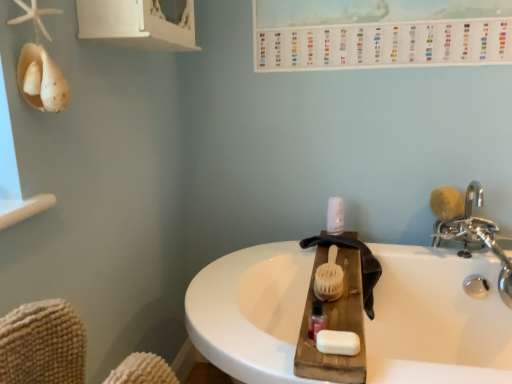
Question: From a real-world perspective, does silver metallic faucet at upper right stand above white plastic pump at center?

Choices:
 (A) yes
 (B) no

Answer: (B)

Question: Considering the relative positions of silver metallic faucet at upper right and white plastic pump at center in the image provided, is silver metallic faucet at upper right to the right of white plastic pump at center from the viewer's perspective?

Choices:
 (A) yes
 (B) no

Answer: (A)

Question: Considering the relative sizes of silver metallic faucet at upper right and white plastic pump at center in the image provided, is silver metallic faucet at upper right smaller than white plastic pump at center?

Choices:
 (A) yes
 (B) no

Answer: (B)

Question: From the image's perspective, would you say silver metallic faucet at upper right is positioned over white plastic pump at center?

Choices:
 (A) no
 (B) yes

Answer: (A)

Question: Does silver metallic faucet at upper right lie behind white plastic pump at center?

Choices:
 (A) yes
 (B) no

Answer: (B)

Question: Considering the positions of white bristle brush at center, the 1th brush when ordered from bottom to top, and white matte soap at center in the image, is white bristle brush at center, the 1th brush when ordered from bottom to top, bigger or smaller than white matte soap at center?

Choices:
 (A) big
 (B) small

Answer: (A)

Question: Relative to white matte soap at center, is white bristle brush at center, the 2th brush when ordered from back to front, in front or behind?

Choices:
 (A) behind
 (B) front

Answer: (A)

Question: Considering the positions of white bristle brush at center, positioned as the 2th brush in right-to-left order, and white matte soap at center in the image, is white bristle brush at center, positioned as the 2th brush in right-to-left order, taller or shorter than white matte soap at center?

Choices:
 (A) tall
 (B) short

Answer: (A)

Question: Is white bristle brush at center, positioned as the 2th brush in right-to-left order, to the left or to the right of white matte soap at center in the image?

Choices:
 (A) left
 (B) right

Answer: (B)

Question: Considering the positions of pink glossy bottle at center and white plastic pump at center in the image, is pink glossy bottle at center taller or shorter than white plastic pump at center?

Choices:
 (A) tall
 (B) short

Answer: (B)

Question: From the image's perspective, relative to white plastic pump at center, is pink glossy bottle at center above or below?

Choices:
 (A) below
 (B) above

Answer: (A)

Question: Considering the positions of point (315, 311) and point (328, 215), is point (315, 311) closer or farther from the camera than point (328, 215)?

Choices:
 (A) closer
 (B) farther

Answer: (A)

Question: From a real-world perspective, relative to white plastic pump at center, is pink glossy bottle at center vertically above or below?

Choices:
 (A) below
 (B) above

Answer: (A)

Question: From their relative heights in the image, would you say silver metallic faucet at upper right is taller or shorter than white matte soap at center?

Choices:
 (A) tall
 (B) short

Answer: (A)

Question: Is silver metallic faucet at upper right in front of or behind white matte soap at center in the image?

Choices:
 (A) behind
 (B) front

Answer: (A)